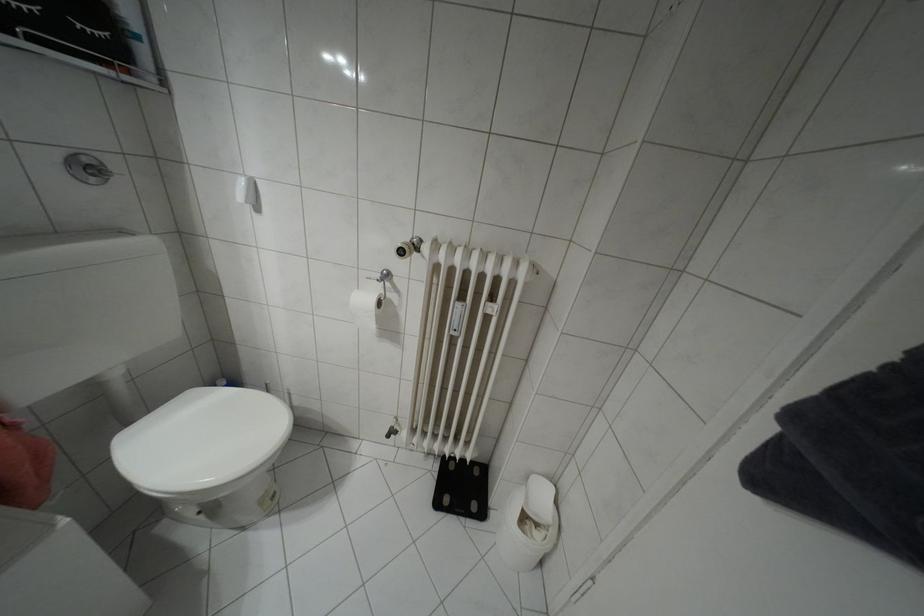
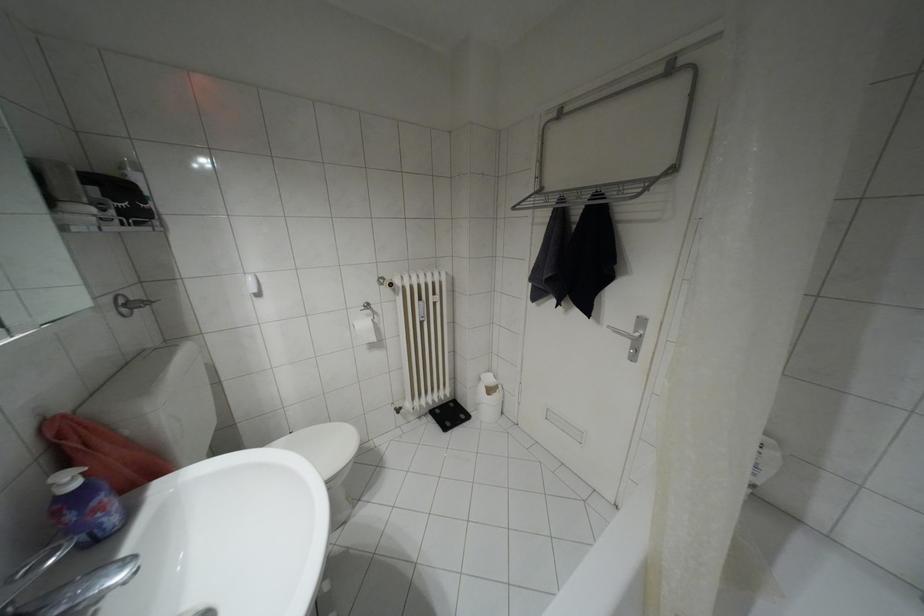
Question: The camera is either moving clockwise (left) or counter-clockwise (right) around the object. The first image is from the beginning of the video and the second image is from the end. Is the camera moving left or right when shooting the video?

Choices:
 (A) Left
 (B) Right

Answer: (A)